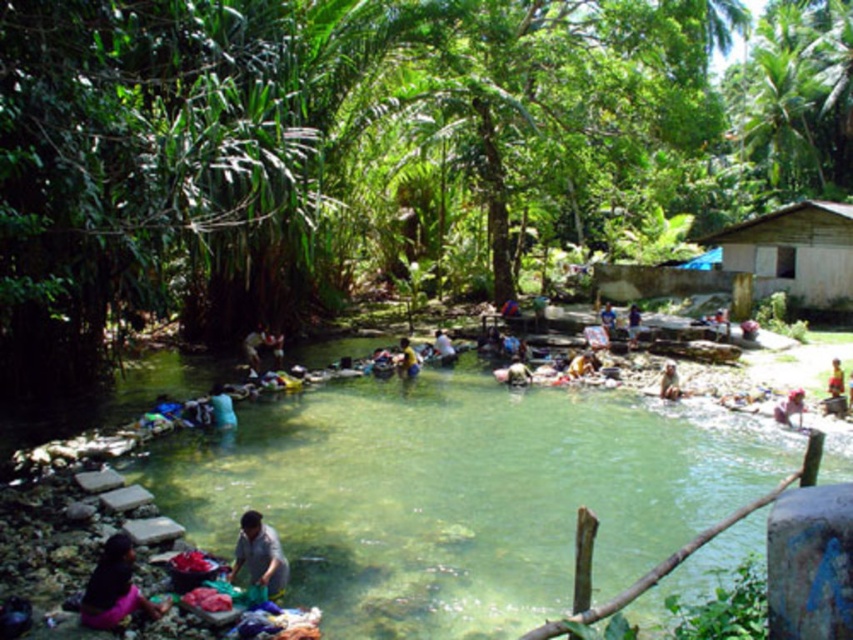
You are standing at the edge of the pool and want to reach both points in the scene. Which point, point (120, 538) or point (415, 362), would you reach first as you move forward?

Point (120, 538) is closer to the viewer than point (415, 362), so you would reach point (120, 538) first.

You are standing at the point labeled point [86,605] and want to walk towards the point labeled point [604,321]. Which direction should you move?

To move from point [86,605] to point [604,321], you should move towards the upper left direction since point [86,605] is in front of point [604,321].

You are standing at the edge of the natural pool and want to pick up both the light brown fabric at center and the yellow fabric at center. If you can carry both items at the same time, how far apart can your hands be stretched?

The light brown fabric at center and yellow fabric at center are 36.19 feet apart, so your hands can be stretched 36.19 feet apart to carry both items.